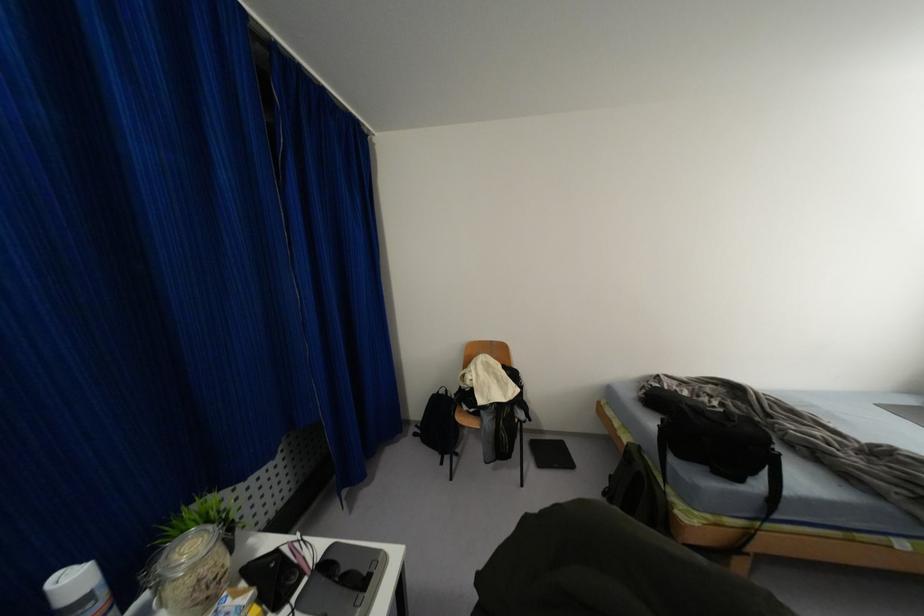
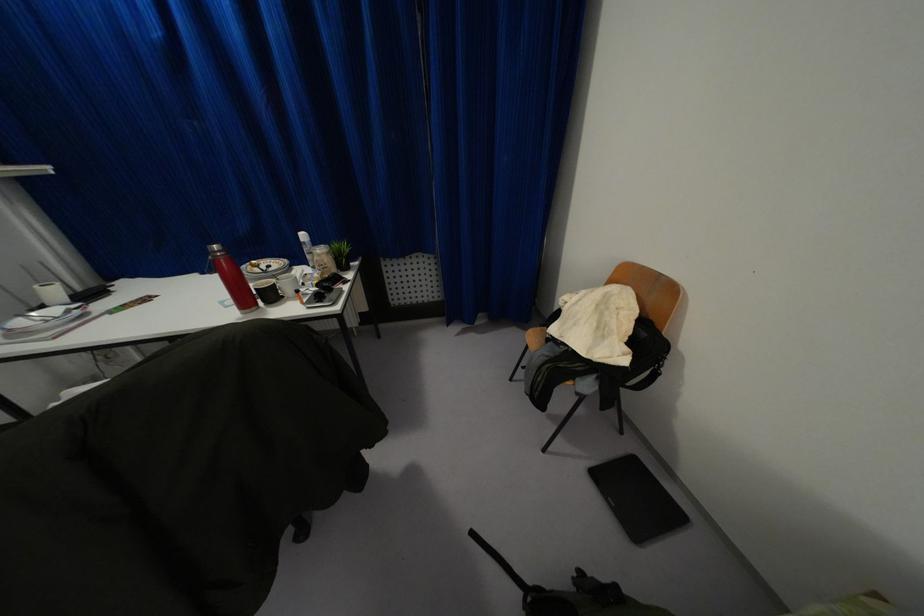
Find the pixel in the second image that matches point (551, 452) in the first image.

(636, 493)